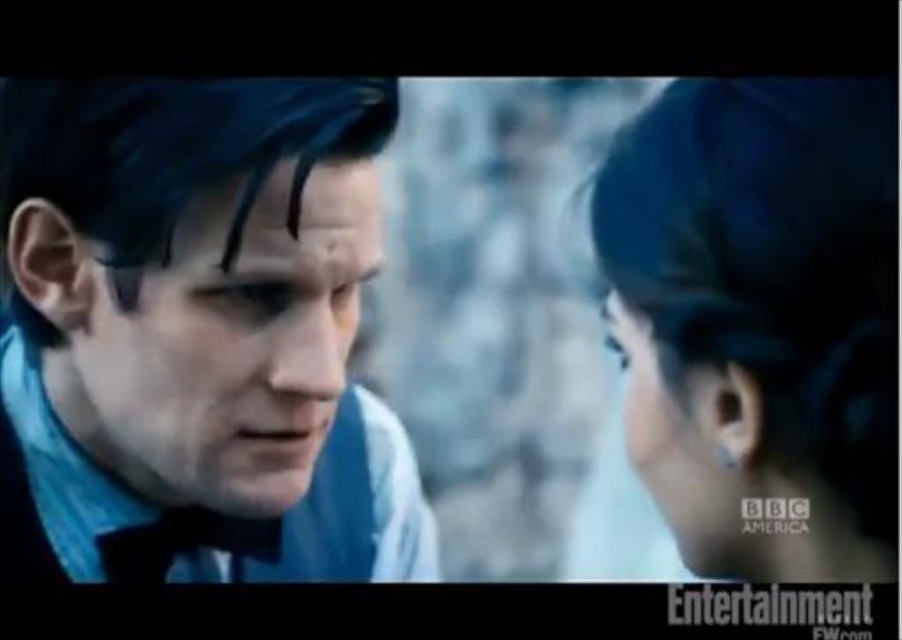
You are a photographer adjusting the focus on a camera capturing this scene. The focus ring needs to be set precisely to the coordinates of the smooth skin forehead at center. What are the exact coordinates you should set the focus ring to?

The exact coordinates for the smooth skin forehead at center are 0.317 on the x axis and 0.303 on the y axis.

Based on the scene description, can you determine if the blue velvet suit at left is positioned above or below the smooth skin forehead at center?

The blue velvet suit at left is located below the smooth skin forehead at center according to the description.

You are a makeup artist observing the scene. You need to apply a highlighter on the smooth skin forehead at center and a brow gel on the black silky eyebrow at upper center. Which object should you address first based on their position?

The smooth skin forehead at center is in front of the black silky eyebrow at upper center, so you should apply the highlighter to the smooth skin forehead at center first before addressing the black silky eyebrow at upper center.